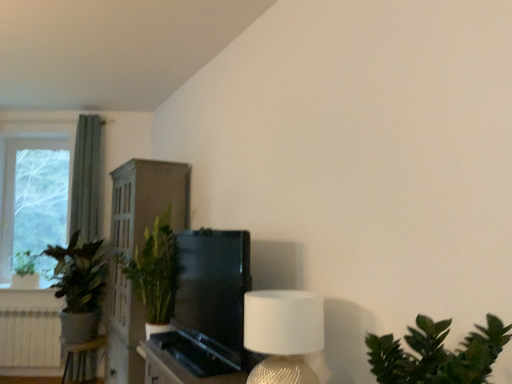
Question: From a real-world perspective, is green matte plant at left, the 1th houseplant from the left, positioned under green leafy plant at left, arranged as the 2th houseplant when viewed from the left, based on gravity?

Choices:
 (A) no
 (B) yes

Answer: (A)

Question: From the image's perspective, does green matte plant at left, positioned as the first houseplant in back-to-front order, appear lower than green leafy plant at left, arranged as the 2th houseplant when viewed from the left?

Choices:
 (A) no
 (B) yes

Answer: (A)

Question: Is green matte plant at left, the 1th houseplant from the left, bigger than green leafy plant at left, arranged as the 2th houseplant when viewed from the left?

Choices:
 (A) no
 (B) yes

Answer: (A)

Question: Considering the relative sizes of green matte plant at left, the 3th houseplant positioned from the front, and green leafy plant at left, the second houseplant positioned from the front, in the image provided, is green matte plant at left, the 3th houseplant positioned from the front, taller than green leafy plant at left, the second houseplant positioned from the front,?

Choices:
 (A) yes
 (B) no

Answer: (B)

Question: Is green matte plant at left, positioned as the first houseplant in back-to-front order, closer to the viewer compared to green leafy plant at left, which ranks as the 2th houseplant in back-to-front order?

Choices:
 (A) yes
 (B) no

Answer: (B)

Question: Considering the positions of white wood cabinet at center and green leafy plant at left, which ranks as the 2th houseplant in back-to-front order, in the image, is white wood cabinet at center bigger or smaller than green leafy plant at left, which ranks as the 2th houseplant in back-to-front order,?

Choices:
 (A) small
 (B) big

Answer: (B)

Question: Is white wood cabinet at center inside the boundaries of green leafy plant at left, the second houseplant positioned from the front, or outside?

Choices:
 (A) outside
 (B) inside

Answer: (A)

Question: Is white wood cabinet at center wider or thinner than green leafy plant at left, the second houseplant positioned from the front?

Choices:
 (A) wide
 (B) thin

Answer: (B)

Question: In the image, is white wood cabinet at center positioned in front of or behind green leafy plant at left, arranged as the 2th houseplant when viewed from the right?

Choices:
 (A) front
 (B) behind

Answer: (A)

Question: From the image's perspective, relative to clear glass window at left, is white textured radiator at lower left above or below?

Choices:
 (A) above
 (B) below

Answer: (B)

Question: From a real-world perspective, is white textured radiator at lower left positioned above or below clear glass window at left?

Choices:
 (A) below
 (B) above

Answer: (A)

Question: In terms of height, does white textured radiator at lower left look taller or shorter compared to clear glass window at left?

Choices:
 (A) short
 (B) tall

Answer: (A)

Question: Is point (29, 340) closer or farther from the camera than point (47, 233)?

Choices:
 (A) closer
 (B) farther

Answer: (A)

Question: From the image's perspective, is green matte plant at left, positioned as the first houseplant in back-to-front order, positioned above or below clear glass window at left?

Choices:
 (A) above
 (B) below

Answer: (B)

Question: Is point (16, 258) closer or farther from the camera than point (62, 215)?

Choices:
 (A) closer
 (B) farther

Answer: (B)